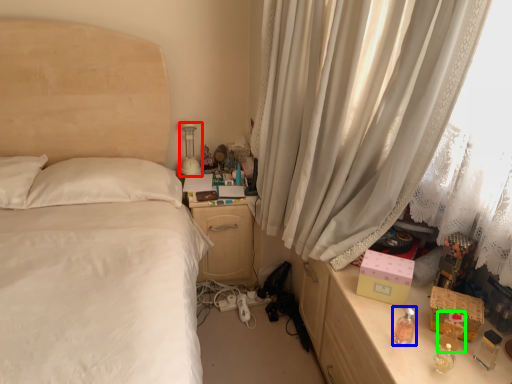
Question: Estimate the real-world distances between objects in this image. Which object is closer to table lamp (highlighted by a red box), perfume (highlighted by a blue box) or perfume (highlighted by a green box)?

Choices:
 (A) perfume
 (B) perfume

Answer: (A)